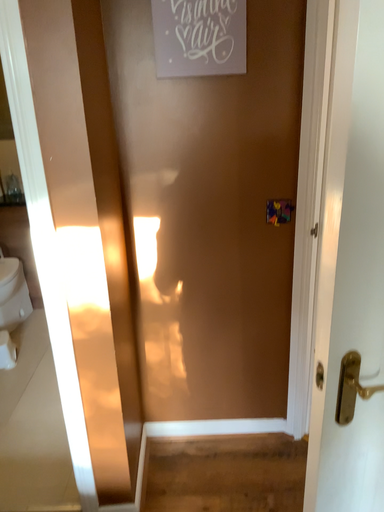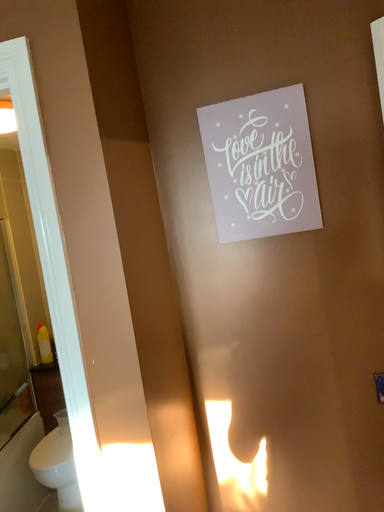
Question: Which way did the camera rotate in the video?

Choices:
 (A) rotated right
 (B) rotated left

Answer: (B)